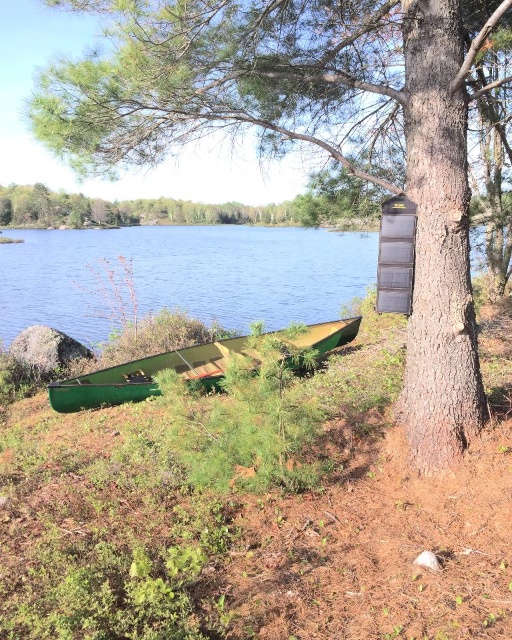
Question: Does smooth bark tree at center have a larger size compared to green wood water at lower left?

Choices:
 (A) no
 (B) yes

Answer: (A)

Question: Which object appears farthest from the camera in this image?

Choices:
 (A) green matte canoe at lower left
 (B) green wood water at lower left

Answer: (B)

Question: Which point is closer to the camera?

Choices:
 (A) smooth bark tree at center
 (B) green wood water at lower left
 (C) green matte canoe at lower left

Answer: (A)

Question: Is green wood water at lower left bigger than green matte canoe at lower left?

Choices:
 (A) yes
 (B) no

Answer: (A)

Question: Which of the following is the closest to the observer?

Choices:
 (A) (170, 0)
 (B) (201, 362)

Answer: (A)

Question: Does smooth bark tree at center lie behind green wood water at lower left?

Choices:
 (A) yes
 (B) no

Answer: (B)